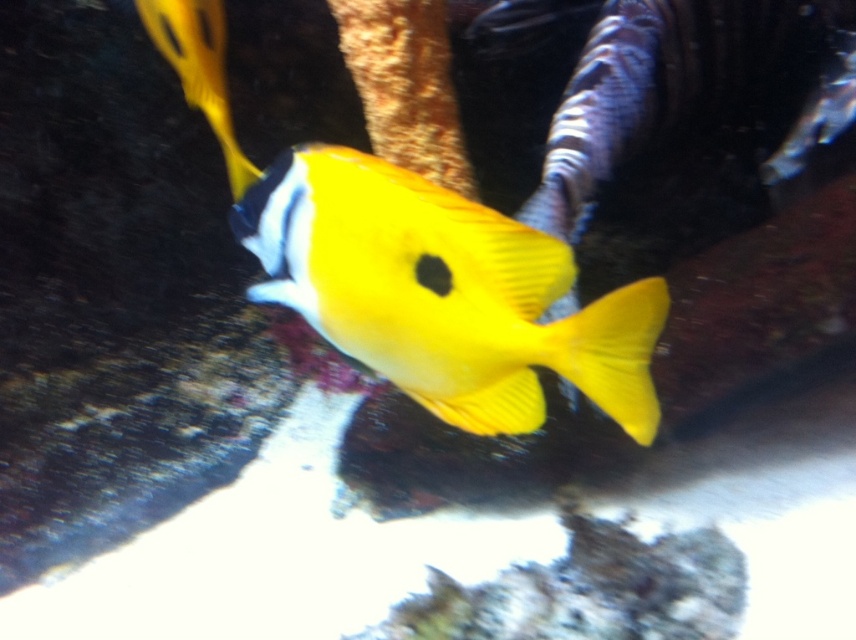
Question: Which of the following is the farthest from the observer?

Choices:
 (A) yellow matte fish at upper left
 (B) yellow matte fish at center

Answer: (A)

Question: Which point is farther to the camera?

Choices:
 (A) (302, 173)
 (B) (242, 157)

Answer: (B)

Question: Can you confirm if yellow matte fish at center is smaller than yellow matte fish at upper left?

Choices:
 (A) no
 (B) yes

Answer: (B)

Question: Is yellow matte fish at center to the right of yellow matte fish at upper left from the viewer's perspective?

Choices:
 (A) yes
 (B) no

Answer: (A)

Question: Considering the relative positions of yellow matte fish at center and yellow matte fish at upper left in the image provided, where is yellow matte fish at center located with respect to yellow matte fish at upper left?

Choices:
 (A) left
 (B) right

Answer: (B)